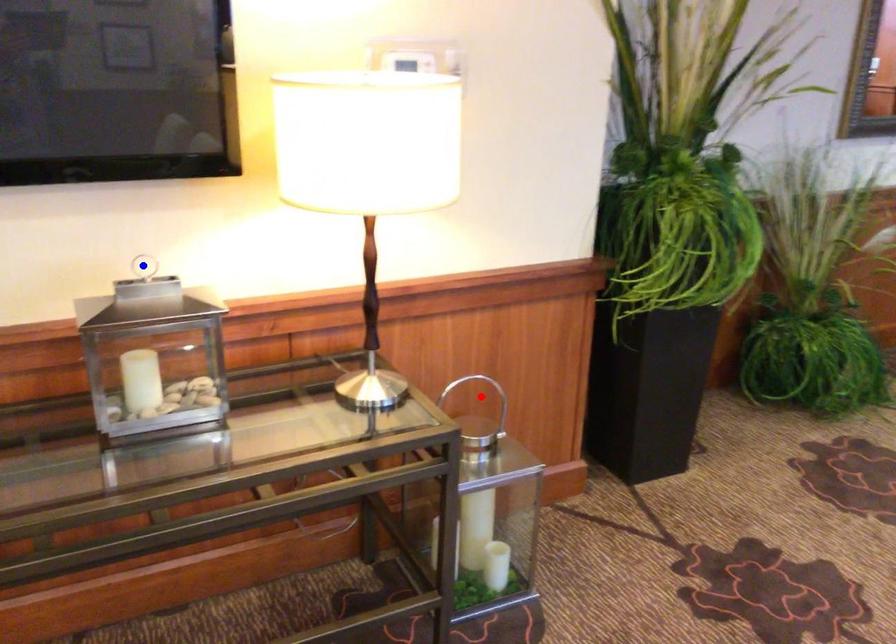
Question: In the image, two points are highlighted. Which point is nearer to the camera? Reply with the corresponding letter.

Choices:
 (A) blue point
 (B) red point

Answer: (A)